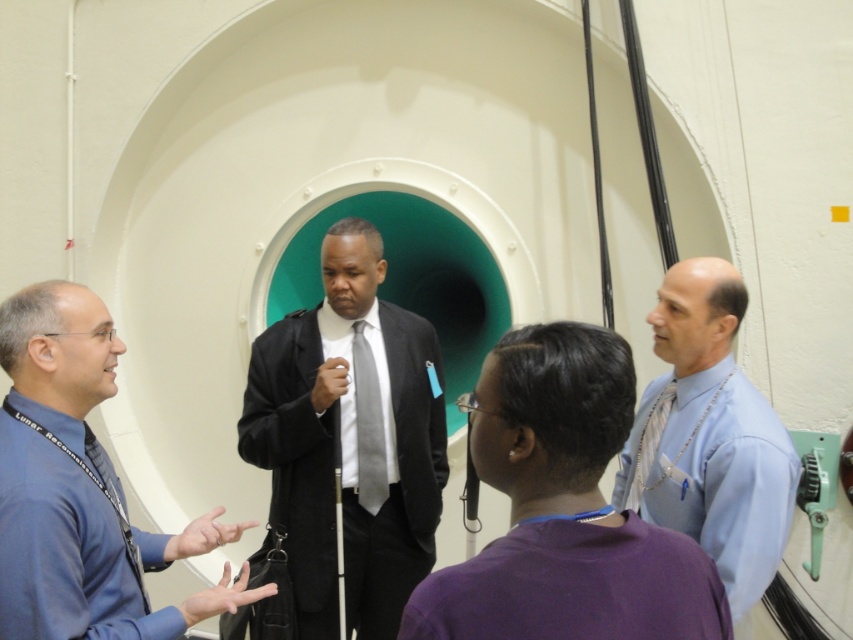
You are standing inside the tunnel and want to move towards the circular opening at the far end. There are two points marked on the tunnel wall at coordinates point (689, 529) and point (635, 474). Which point is closer to you as you face the opening?

Point (689, 529) is closer to the viewer than point (635, 474), so the point closer to you as you face the opening is point (689, 529).

You are standing at point (39, 369) and want to walk to the circular opening at the far end of the tunnel. The tunnel is 10 meters long. If you walk at a speed of 1.2 meters per second, how long will it take you to reach the opening?

The tunnel is 10 meters long, so it will take you 10 meters divided by 1.2 meters per second, which equals approximately 8.33 seconds to reach the circular opening at the far end.

You are a fashion designer observing the scene. You need to determine if the distance between the matte black suit at center and the gray satin tie at center is sufficient to accommodate a 6 inch long measuring tape. Can the tape fit between them without bending?

The distance between the matte black suit at center and the gray satin tie at center is 5.41 inches. Since the tape is 6 inches long, it cannot fit between them without bending.